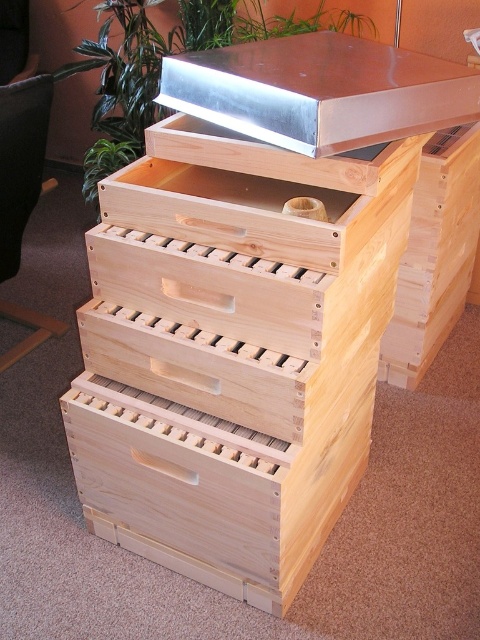
You are a beekeeper standing at the origin point of the coordinate system. You need to place a new wooden crate at the same location as the natural wood crate at center. What coordinates should you use?

The natural wood crate at center is located at coordinates point [233,352], so you should place the new wooden crate at coordinates [233,352].

You are a beekeeper standing at the base of the beekeeping boxes. You notice two points marked on the boxes. One is at point (336, 196) and the other at point (172, 67). Which point is closer to you?

Point (172, 67) is closer to you because it is in front of point (336, 196).

You are a beekeeper who needs to place a new tool that is 15 inches long into the space between the natural wood crate at center and the metallic silver at upper center. Will the tool fit in that space?

The space between the natural wood crate at center and the metallic silver at upper center is 14.80 inches, which is slightly shorter than the 15 inch tool. Therefore, the tool will not fit in that space.